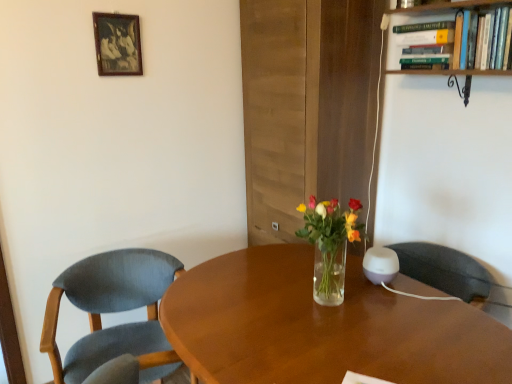
The width and height of the screenshot is (512, 384). Identify the location of blank area beneath wooden bookshelf at upper right (from a real-world perspective). (444, 248).